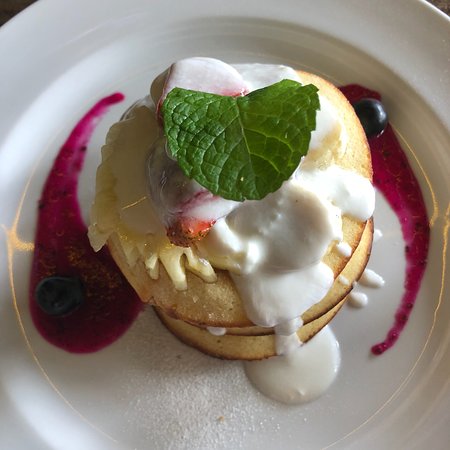
Image resolution: width=450 pixels, height=450 pixels. Find the location of `bowl`. bowl is located at coordinates (49, 108), (61, 372), (436, 394).